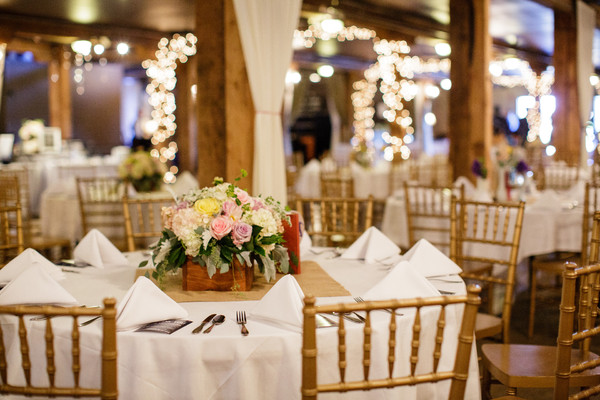
Locate an element on the screen. The width and height of the screenshot is (600, 400). dark wood box is located at coordinates (191, 278).